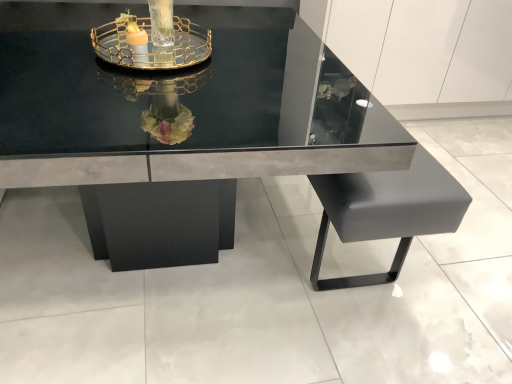
At what (x,y) coordinates should I click in order to perform the action: click on glossy black table at center. Please return your answer as a coordinate pair (x, y). The width and height of the screenshot is (512, 384). Looking at the image, I should click on (175, 119).

This screenshot has width=512, height=384. What do you see at coordinates (175, 119) in the screenshot?
I see `glossy black table at center` at bounding box center [175, 119].

Describe the element at coordinates (150, 44) in the screenshot. I see `clear glass tray at upper center` at that location.

At what (x,y) coordinates should I click in order to perform the action: click on clear glass tray at upper center. Please return your answer as a coordinate pair (x, y). Image resolution: width=512 pixels, height=384 pixels. Looking at the image, I should click on [x=150, y=44].

Find the location of `glossy black table at center`. glossy black table at center is located at coordinates (175, 119).

Is clear glass tray at upper center to the left or to the right of glossy black table at center in the image?

clear glass tray at upper center is to the right of glossy black table at center.

Is clear glass tray at upper center in front of or behind glossy black table at center in the image?

clear glass tray at upper center is positioned farther from the viewer than glossy black table at center.

Considering the points (170, 62) and (174, 182), which point is behind, point (170, 62) or point (174, 182)?

The point (174, 182) is more distant.

From the image's perspective, is clear glass tray at upper center over glossy black table at center?

Yes, from the image's perspective, clear glass tray at upper center is on top of glossy black table at center.

From a real-world perspective, is clear glass tray at upper center positioned under glossy black table at center based on gravity?

Actually, clear glass tray at upper center is physically above glossy black table at center in the real world.

Which of these two, clear glass tray at upper center or glossy black table at center, is thinner?

Thinner between the two is clear glass tray at upper center.

From the picture: Can you confirm if clear glass tray at upper center is shorter than glossy black table at center?

Yes.

Considering the sizes of objects clear glass tray at upper center and glossy black table at center in the image provided, who is smaller, clear glass tray at upper center or glossy black table at center?

Smaller between the two is clear glass tray at upper center.

Is clear glass tray at upper center outside of glossy black table at center?

Yes.

Looking at this image, are clear glass tray at upper center and glossy black table at center far apart?

No, clear glass tray at upper center is not far away from glossy black table at center.

Is clear glass tray at upper center facing towards glossy black table at center?

No, clear glass tray at upper center is not turned towards glossy black table at center.

Where is `table in front of the clear glass tray at upper center`? This screenshot has height=384, width=512. table in front of the clear glass tray at upper center is located at coordinates [x=175, y=119].

Between glossy black table at center and clear glass tray at upper center, which one appears on the left side from the viewer's perspective?

glossy black table at center is more to the left.

Which object is further away from the camera, glossy black table at center or clear glass tray at upper center?

clear glass tray at upper center.

Does point (245, 80) lie in front of point (122, 49)?

Yes, it is.

From the image's perspective, which is below, glossy black table at center or clear glass tray at upper center?

From the image's view, glossy black table at center is below.

In the scene shown: From a real-world perspective, is glossy black table at center physically located above or below clear glass tray at upper center?

Clearly, from a real-world perspective, glossy black table at center is below clear glass tray at upper center.

In the scene shown: Considering the relative sizes of glossy black table at center and clear glass tray at upper center in the image provided, is glossy black table at center thinner than clear glass tray at upper center?

No, glossy black table at center is not thinner than clear glass tray at upper center.

Considering the relative sizes of glossy black table at center and clear glass tray at upper center in the image provided, is glossy black table at center taller than clear glass tray at upper center?

Correct, glossy black table at center is much taller as clear glass tray at upper center.

Between glossy black table at center and clear glass tray at upper center, which one has smaller size?

clear glass tray at upper center.

Is glossy black table at center situated inside clear glass tray at upper center or outside?

glossy black table at center is spatially situated outside clear glass tray at upper center.

Is glossy black table at center next to clear glass tray at upper center and touching it?

glossy black table at center and clear glass tray at upper center are not in contact.

Is glossy black table at center facing towards clear glass tray at upper center?

No, glossy black table at center is not oriented towards clear glass tray at upper center.

Looking at this image, how many degrees apart are the facing directions of glossy black table at center and clear glass tray at upper center?

glossy black table at center and clear glass tray at upper center are facing 3.62 degrees away from each other.

How much distance is there between glossy black table at center and clear glass tray at upper center?

5.42 inches.

The height and width of the screenshot is (384, 512). I want to click on table in front of the clear glass tray at upper center, so click(175, 119).

This screenshot has height=384, width=512. In order to click on glass box to the right of glossy black table at center in this screenshot , I will do `click(150, 44)`.

The image size is (512, 384). I want to click on glass box lying behind the glossy black table at center, so click(x=150, y=44).